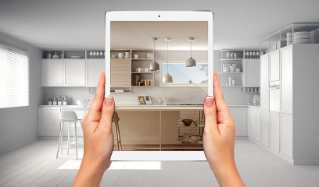
Where is `window`? window is located at coordinates (11, 78).